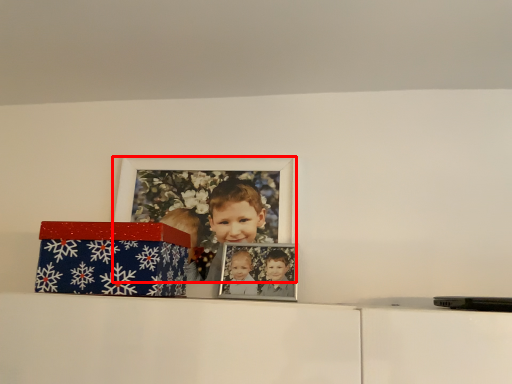
Question: Where is picture frame (annotated by the red box) located in relation to box in the image?

Choices:
 (A) right
 (B) left

Answer: (A)